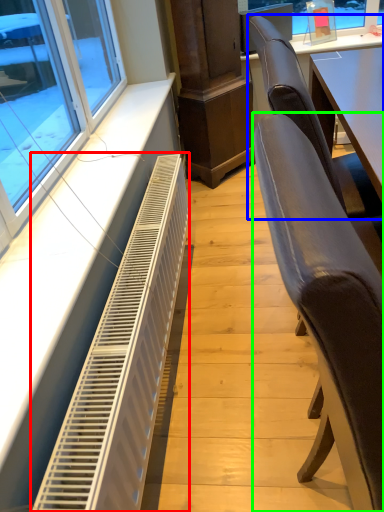
Question: Which object is positioned closest to air conditioning (highlighted by a red box)? Select from chair (highlighted by a blue box) and chair (highlighted by a green box).

Choices:
 (A) chair
 (B) chair

Answer: (B)